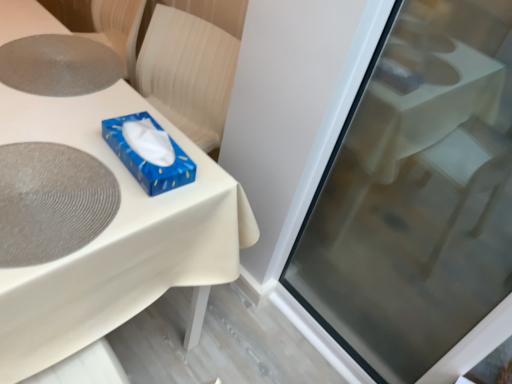
Locate an element on the screen. Image resolution: width=512 pixels, height=384 pixels. free space between gray textured placemat at upper left, placed as the 2th oval when sorted from bottom to top, and blue glossy tissue box at upper center is located at coordinates (89, 109).